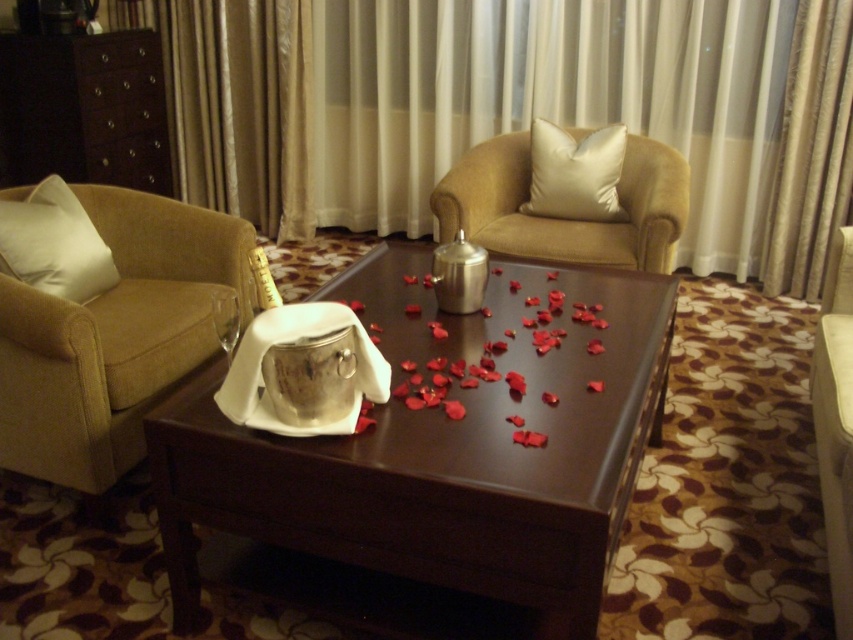
Question: Can you confirm if brown leather table at center is positioned below matte beige armchair at left?

Choices:
 (A) no
 (B) yes

Answer: (B)

Question: Which of the following is the closest to the observer?

Choices:
 (A) (653, 230)
 (B) (422, 330)
 (C) (560, 166)

Answer: (B)

Question: Which point is farther to the camera?

Choices:
 (A) matte beige armchair at left
 (B) brown leather table at center
 (C) beige fabric armchair at right

Answer: (A)

Question: Can you confirm if brown leather table at center is smaller than silky white pillow at upper right?

Choices:
 (A) yes
 (B) no

Answer: (B)

Question: Which point is closer to the camera?

Choices:
 (A) [399, 426]
 (B) [192, 296]
 (C) [543, 193]
 (D) [79, 266]

Answer: (A)

Question: Can you confirm if beige fabric armchair at right is positioned to the left of white soft pillow at left?

Choices:
 (A) no
 (B) yes

Answer: (A)